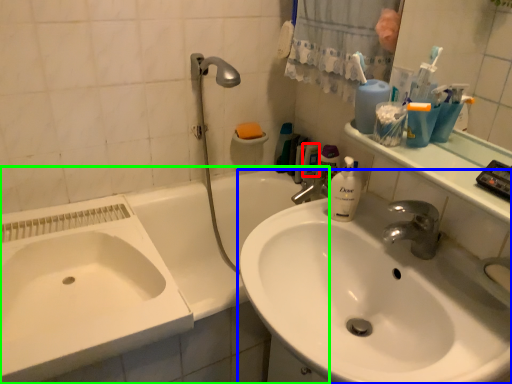
Question: Estimate the real-world distances between objects in this image. Which object is farther from mouthwash (highlighted by a red box), sink (highlighted by a blue box) or bathtub (highlighted by a green box)?

Choices:
 (A) sink
 (B) bathtub

Answer: (A)